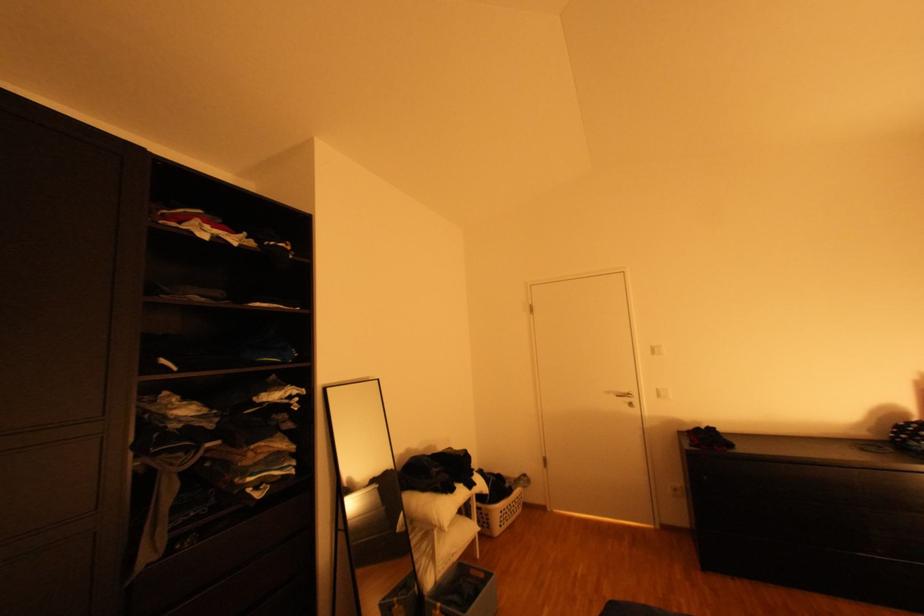
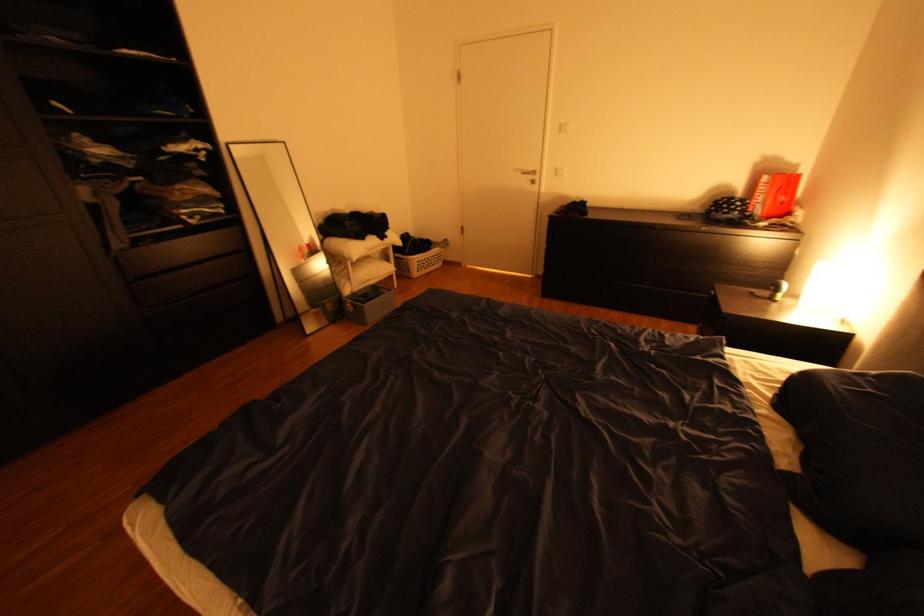
In the second image, find the point that corresponds to pixel 516 513 in the first image.

(433, 264)